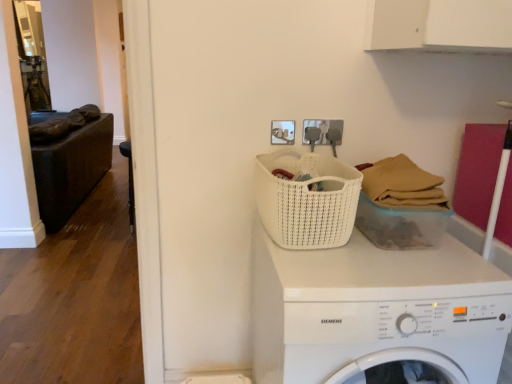
Question: From a real-world perspective, is white woven basket at center, which is the second basket in left-to-right order, below white plastic washing machine at center?

Choices:
 (A) yes
 (B) no

Answer: (B)

Question: From a real-world perspective, is white woven basket at center, which is the second basket in left-to-right order, on top of white plastic washing machine at center?

Choices:
 (A) no
 (B) yes

Answer: (B)

Question: Are white woven basket at center, which is counted as the first basket, starting from the right, and white plastic washing machine at center far apart?

Choices:
 (A) yes
 (B) no

Answer: (B)

Question: Can you confirm if white woven basket at center, which is counted as the first basket, starting from the right, is shorter than white plastic washing machine at center?

Choices:
 (A) no
 (B) yes

Answer: (B)

Question: Is white woven basket at center, which is counted as the first basket, starting from the right, at the left side of white plastic washing machine at center?

Choices:
 (A) no
 (B) yes

Answer: (A)

Question: Could you tell me if white woven basket at center, which is counted as the first basket, starting from the right, is facing white plastic washing machine at center?

Choices:
 (A) no
 (B) yes

Answer: (A)

Question: Is white woven basket at center, which is the second basket in left-to-right order, thinner than white woven basket at center, which is counted as the second basket, starting from the right?

Choices:
 (A) no
 (B) yes

Answer: (B)

Question: From the image's perspective, is white woven basket at center, which is counted as the first basket, starting from the right, beneath white woven basket at center, placed as the first basket when sorted from left to right?

Choices:
 (A) no
 (B) yes

Answer: (B)

Question: Is white woven basket at center, which is the second basket in left-to-right order, smaller than white woven basket at center, which is counted as the second basket, starting from the right?

Choices:
 (A) yes
 (B) no

Answer: (A)

Question: Does white woven basket at center, which is the second basket in left-to-right order, have a greater width compared to white woven basket at center, which is counted as the second basket, starting from the right?

Choices:
 (A) no
 (B) yes

Answer: (A)

Question: From a real-world perspective, is white woven basket at center, which is the second basket in left-to-right order, on top of white woven basket at center, which is counted as the second basket, starting from the right?

Choices:
 (A) yes
 (B) no

Answer: (B)

Question: Is white woven basket at center, which is counted as the first basket, starting from the right, at the right side of white woven basket at center, which is counted as the second basket, starting from the right?

Choices:
 (A) yes
 (B) no

Answer: (A)

Question: From a real-world perspective, does white woven basket at center, placed as the first basket when sorted from left to right, sit lower than white woven basket at center, which is counted as the first basket, starting from the right?

Choices:
 (A) no
 (B) yes

Answer: (A)